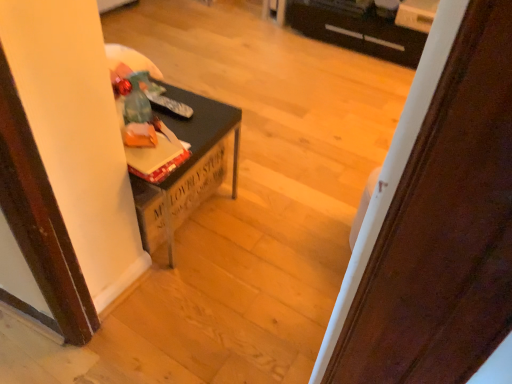
Question: Is point (430, 210) positioned closer to the camera than point (145, 243)?

Choices:
 (A) closer
 (B) farther

Answer: (A)

Question: From their relative heights in the image, would you say wooden door at center is taller or shorter than matte black table at left?

Choices:
 (A) tall
 (B) short

Answer: (A)

Question: Which object is positioned farthest from the matte black table at left?

Choices:
 (A) wooden door at center
 (B) black plastic drawer at upper center

Answer: (B)

Question: Which object is positioned farthest from the wooden door at center?

Choices:
 (A) matte black table at left
 (B) black plastic drawer at upper center

Answer: (B)